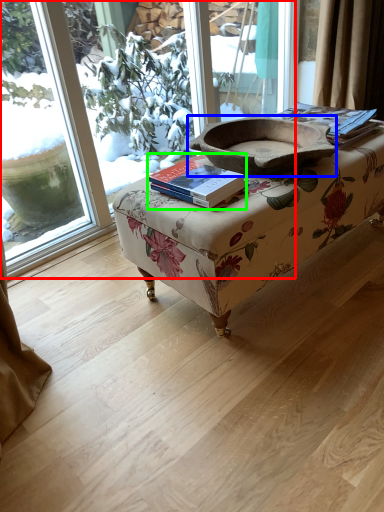
Question: Considering the real-world distances, which object is farthest from window (highlighted by a red box)? footrest (highlighted by a blue box) or paperback book (highlighted by a green box)?

Choices:
 (A) footrest
 (B) paperback book

Answer: (B)